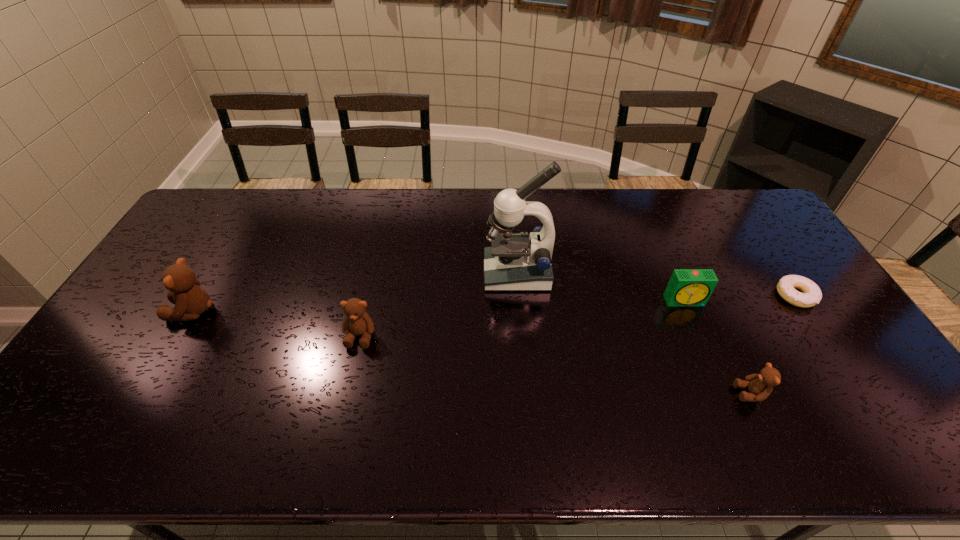
This screenshot has height=540, width=960. In order to click on the leftmost object in this screenshot , I will do `click(191, 300)`.

This screenshot has width=960, height=540. Identify the location of the fifth shortest object. (191, 300).

I want to click on the second teddy bear from left to right, so click(x=357, y=322).

Identify the location of the fifth object from right to left. Image resolution: width=960 pixels, height=540 pixels. (357, 322).

This screenshot has height=540, width=960. Find the location of `the rightmost teddy bear`. the rightmost teddy bear is located at coordinates (760, 386).

Identify the location of the nearest teddy bear. This screenshot has width=960, height=540. (760, 386).

The height and width of the screenshot is (540, 960). I want to click on doughnut, so click(787, 285).

You are a GUI agent. You are given a task and a screenshot of the screen. Output one action in this format:
    pyautogui.click(x=<x>, y=<y>)
    Task: Click on the rightmost object
    The height and width of the screenshot is (540, 960).
    Given the screenshot: What is the action you would take?
    pyautogui.click(x=787, y=285)

Identify the location of alarm clock. (687, 287).

Where is `the tallest object`? This screenshot has width=960, height=540. the tallest object is located at coordinates (514, 262).